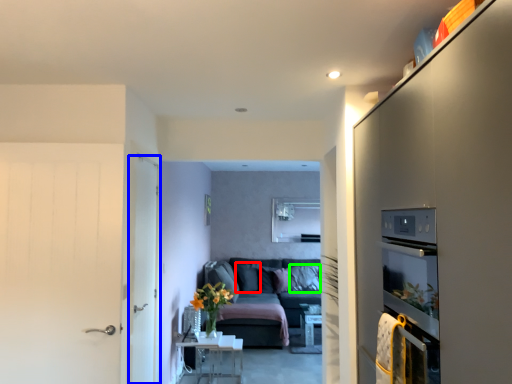
Question: Based on their relative distances, which object is nearer to pillow (highlighted by a red box)? Choose from door (highlighted by a blue box) and pillow (highlighted by a green box).

Choices:
 (A) door
 (B) pillow

Answer: (B)